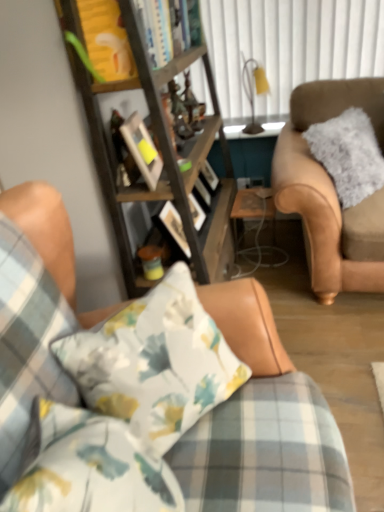
Question: Is metallic gold lamp at upper right not near floral fabric pillow at center?

Choices:
 (A) yes
 (B) no

Answer: (A)

Question: From a real-world perspective, is metallic gold lamp at upper right on floral fabric pillow at center?

Choices:
 (A) yes
 (B) no

Answer: (A)

Question: Is metallic gold lamp at upper right to the right of floral fabric pillow at center from the viewer's perspective?

Choices:
 (A) no
 (B) yes

Answer: (B)

Question: Is metallic gold lamp at upper right behind floral fabric pillow at center?

Choices:
 (A) no
 (B) yes

Answer: (B)

Question: Does metallic gold lamp at upper right have a smaller size compared to floral fabric pillow at center?

Choices:
 (A) yes
 (B) no

Answer: (A)

Question: Could you tell me if metallic gold lamp at upper right is turned towards floral fabric pillow at center?

Choices:
 (A) yes
 (B) no

Answer: (A)

Question: Can you confirm if wooden picture frame at center is bigger than matte brown coffee cup at center?

Choices:
 (A) yes
 (B) no

Answer: (A)

Question: Considering the relative sizes of wooden picture frame at center and matte brown coffee cup at center in the image provided, is wooden picture frame at center taller than matte brown coffee cup at center?

Choices:
 (A) yes
 (B) no

Answer: (A)

Question: Considering the relative sizes of wooden picture frame at center and matte brown coffee cup at center in the image provided, is wooden picture frame at center wider than matte brown coffee cup at center?

Choices:
 (A) yes
 (B) no

Answer: (B)

Question: Considering the relative sizes of wooden picture frame at center and matte brown coffee cup at center in the image provided, is wooden picture frame at center smaller than matte brown coffee cup at center?

Choices:
 (A) no
 (B) yes

Answer: (A)

Question: Can you confirm if wooden picture frame at center is thinner than matte brown coffee cup at center?

Choices:
 (A) no
 (B) yes

Answer: (B)

Question: Is wooden picture frame at center turned away from matte brown coffee cup at center?

Choices:
 (A) yes
 (B) no

Answer: (B)

Question: Can you confirm if clear glass table at center is positioned to the left of wooden picture frame at center?

Choices:
 (A) yes
 (B) no

Answer: (B)